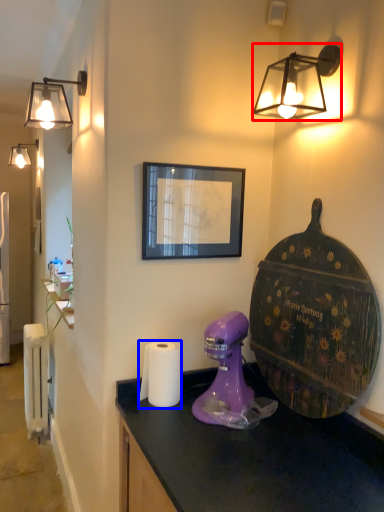
Question: Which object appears closest to the camera in this image, lamp (highlighted by a red box) or toilet paper (highlighted by a blue box)?

Choices:
 (A) lamp
 (B) toilet paper

Answer: (A)